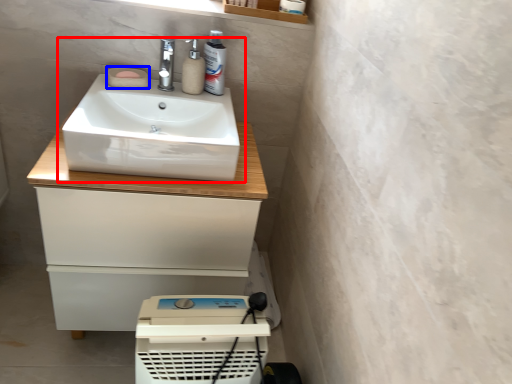
Question: Among these objects, which one is nearest to the camera, sink (highlighted by a red box) or soap (highlighted by a blue box)?

Choices:
 (A) sink
 (B) soap

Answer: (A)